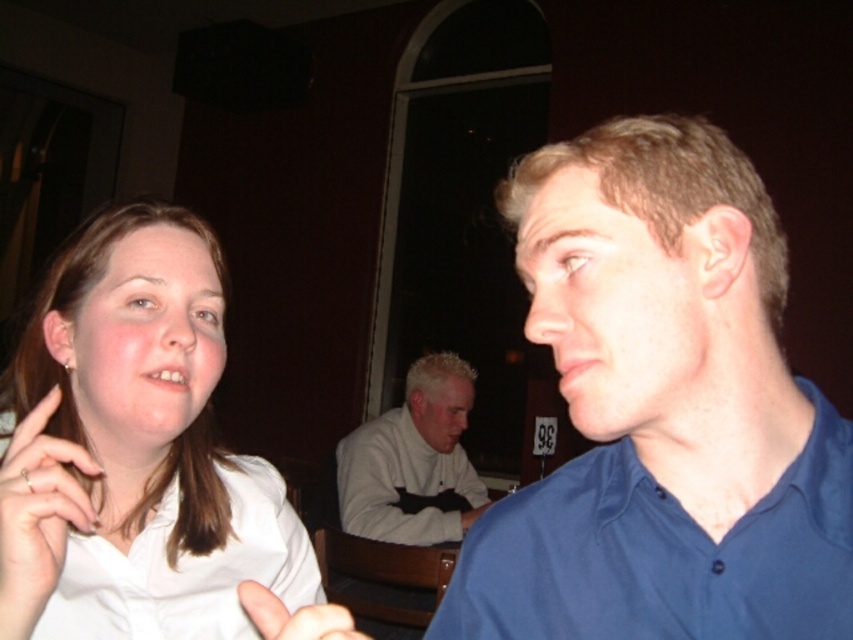
You are a photographer trying to capture a candid shot of the blue cotton shirt at right and the white matte ring at lower left. Which object should you focus on first if you want to ensure both are in frame without moving the camera?

The blue cotton shirt at right is taller than the white matte ring at lower left, so focusing on the blue cotton shirt at right first would help ensure both are in frame since it requires more vertical space.

Based on the photo, you are standing in the room and want to move from point A to point B. Point A is at coordinates point (x=358, y=509) and point B is at coordinates point (x=4, y=600). Which point is closer to you?

Point (x=358, y=509) is closer to you because it is further to the viewer than point (x=4, y=600).

You are standing in the scene and want to move from the point at coordinates point (16,490) to the point at coordinates point (311,618). Which direction should you move in to get closer to the second point?

You should move towards the direction away from the viewer since point (16,490) is closer to you than point (311,618).